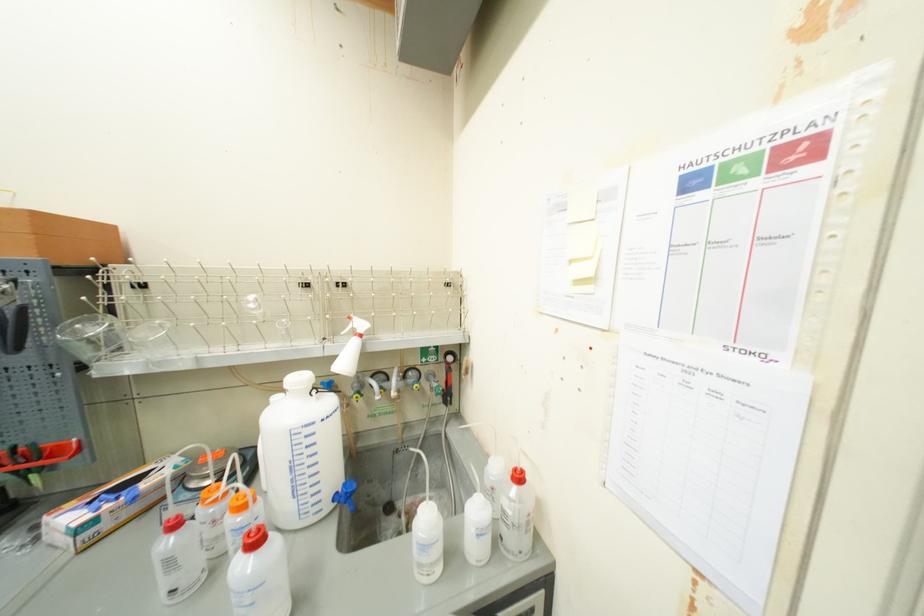
Where is `box of gloves`? box of gloves is located at coordinates 110,505.